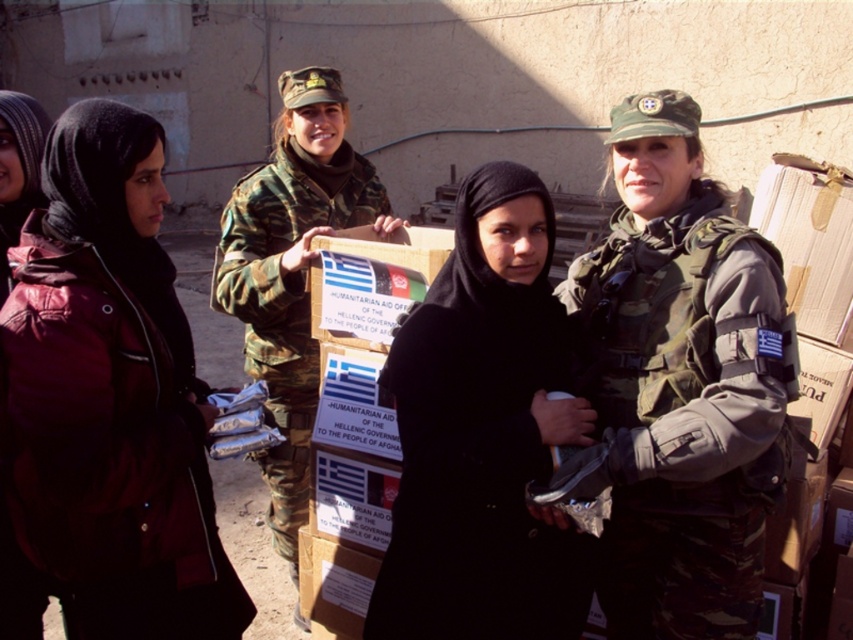
Question: Can you confirm if matte black jacket at left is positioned to the left of camouflage fabric uniform at center?

Choices:
 (A) no
 (B) yes

Answer: (B)

Question: Considering the real-world distances, which object is farthest from the black matte hijab at center?

Choices:
 (A) camo fabric vest at center
 (B) matte black jacket at left

Answer: (B)

Question: Which of the following is the farthest from the observer?

Choices:
 (A) (253, 340)
 (B) (589, 272)
 (C) (25, 205)

Answer: (A)

Question: In this image, where is black matte hijab at center located relative to matte red jacket at left?

Choices:
 (A) above
 (B) below

Answer: (B)

Question: From the image, what is the correct spatial relationship of matte black jacket at left in relation to black matte hijab at center?

Choices:
 (A) right
 (B) left

Answer: (B)

Question: Considering the real-world distances, which object is farthest from the matte red jacket at left?

Choices:
 (A) camouflage fabric uniform at center
 (B) matte black jacket at left
 (C) camo fabric vest at center
 (D) black matte hijab at center

Answer: (C)